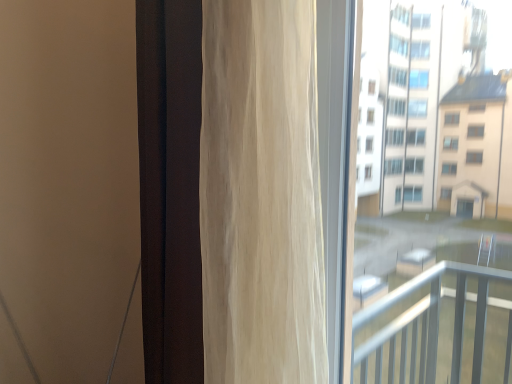
Measure the distance between transparent glass bay window at right and camera.

A distance of 1.27 meters exists between transparent glass bay window at right and camera.

Where is `transparent glass bay window at right`? transparent glass bay window at right is located at coordinates (382, 350).

What is the approximate width of transparent glass bay window at right?

transparent glass bay window at right is 2.39 inches in width.

This screenshot has height=384, width=512. Describe the element at coordinates (382, 350) in the screenshot. I see `transparent glass bay window at right` at that location.

Locate an element on the screen. This screenshot has width=512, height=384. transparent glass bay window at right is located at coordinates (382, 350).